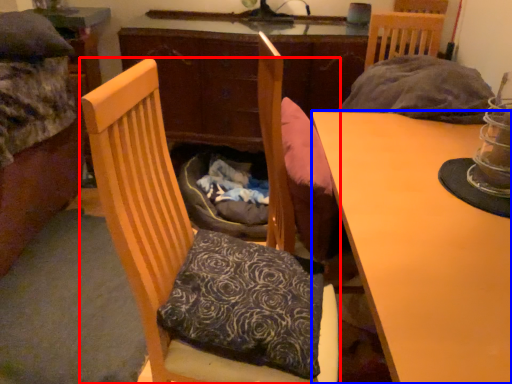
Question: Which of the following is the farthest to the observer, chair (highlighted by a red box) or desk (highlighted by a blue box)?

Choices:
 (A) chair
 (B) desk

Answer: (A)